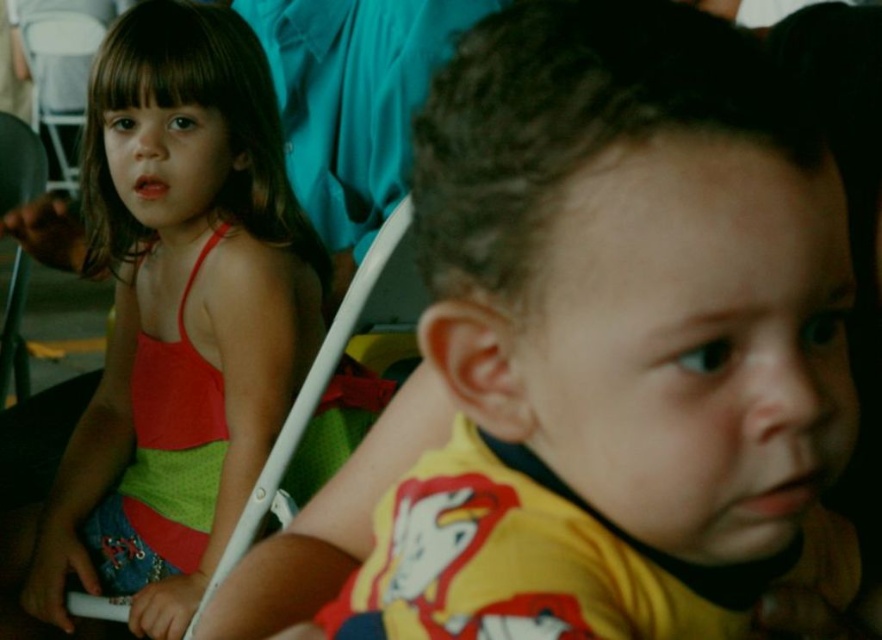
Question: Can you confirm if matte red tank top at left is bigger than white plastic chair at center?

Choices:
 (A) yes
 (B) no

Answer: (B)

Question: Is matte red tank top at left further to camera compared to white plastic chair at center?

Choices:
 (A) no
 (B) yes

Answer: (B)

Question: Which object appears closest to the camera in this image?

Choices:
 (A) matte red tank top at left
 (B) white plastic chair at center

Answer: (B)

Question: Can you confirm if matte red tank top at left is bigger than white plastic chair at center?

Choices:
 (A) no
 (B) yes

Answer: (A)

Question: Which point is farther from the camera taking this photo?

Choices:
 (A) (135, 269)
 (B) (311, 400)

Answer: (A)